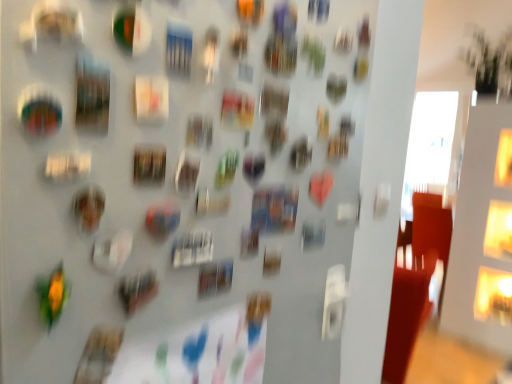
In order to face glossy wood chair at right, should I rotate leftwards or rightwards?

Rotate your view right by about 19.930°.

Measure the distance between glossy wood chair at right and camera.

glossy wood chair at right and camera are 3.73 meters apart from each other.

Measure the distance between point (x=406, y=349) and camera.

A distance of 1.82 meters exists between point (x=406, y=349) and camera.

Find the location of a particular element. glossy wood chair at right is located at coordinates (415, 281).

This screenshot has width=512, height=384. What do you see at coordinates (415, 281) in the screenshot? I see `glossy wood chair at right` at bounding box center [415, 281].

Image resolution: width=512 pixels, height=384 pixels. Identify the location of glossy wood chair at right. (415, 281).